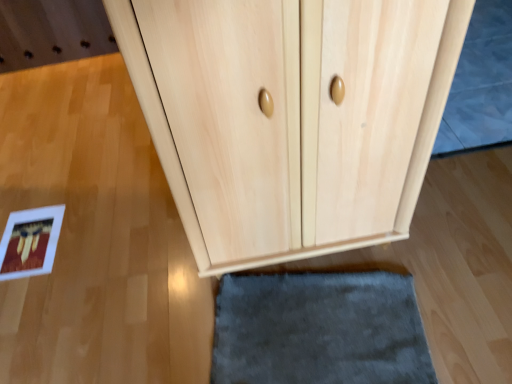
Question: From a real-world perspective, is natural wood cupboard at center beneath gray soft rug at upper right?

Choices:
 (A) no
 (B) yes

Answer: (A)

Question: Is natural wood cupboard at center looking in the opposite direction of gray soft rug at upper right?

Choices:
 (A) yes
 (B) no

Answer: (B)

Question: Is the position of natural wood cupboard at center less distant than that of gray soft rug at upper right?

Choices:
 (A) no
 (B) yes

Answer: (B)

Question: From the image's perspective, is natural wood cupboard at center on gray soft rug at upper right?

Choices:
 (A) no
 (B) yes

Answer: (A)

Question: Would you say gray soft rug at upper right is part of natural wood cupboard at center's contents?

Choices:
 (A) yes
 (B) no

Answer: (B)

Question: Can you see natural wood cupboard at center touching gray soft rug at upper right?

Choices:
 (A) no
 (B) yes

Answer: (A)

Question: Is natural wood cupboard at center looking in the opposite direction of light wood door at center?

Choices:
 (A) yes
 (B) no

Answer: (B)

Question: Is natural wood cupboard at center thinner than light wood door at center?

Choices:
 (A) yes
 (B) no

Answer: (B)

Question: Can you confirm if natural wood cupboard at center is taller than light wood door at center?

Choices:
 (A) yes
 (B) no

Answer: (A)

Question: From a real-world perspective, is natural wood cupboard at center positioned over light wood door at center based on gravity?

Choices:
 (A) no
 (B) yes

Answer: (B)

Question: Is natural wood cupboard at center outside light wood door at center?

Choices:
 (A) no
 (B) yes

Answer: (B)

Question: Can you confirm if natural wood cupboard at center is positioned to the left of light wood door at center?

Choices:
 (A) no
 (B) yes

Answer: (B)

Question: Is light wood door at center oriented away from gray soft rug at upper right?

Choices:
 (A) no
 (B) yes

Answer: (A)